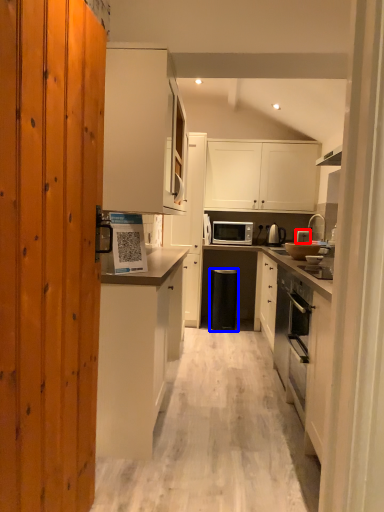
Question: Which of the following is the farthest to the observer, appliance (highlighted by a red box) or trash bin/can (highlighted by a blue box)?

Choices:
 (A) appliance
 (B) trash bin/can

Answer: (A)